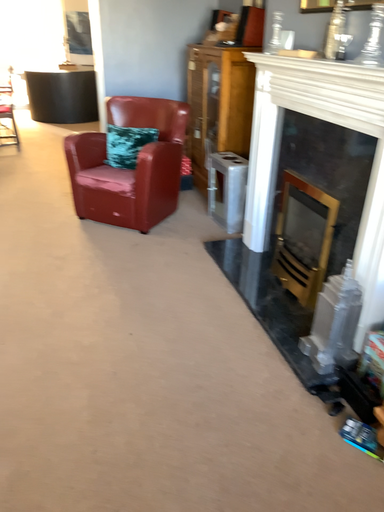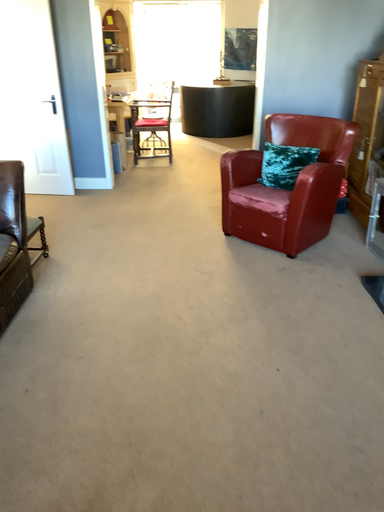
Question: How did the camera likely rotate when shooting the video?

Choices:
 (A) rotated right
 (B) rotated left

Answer: (B)